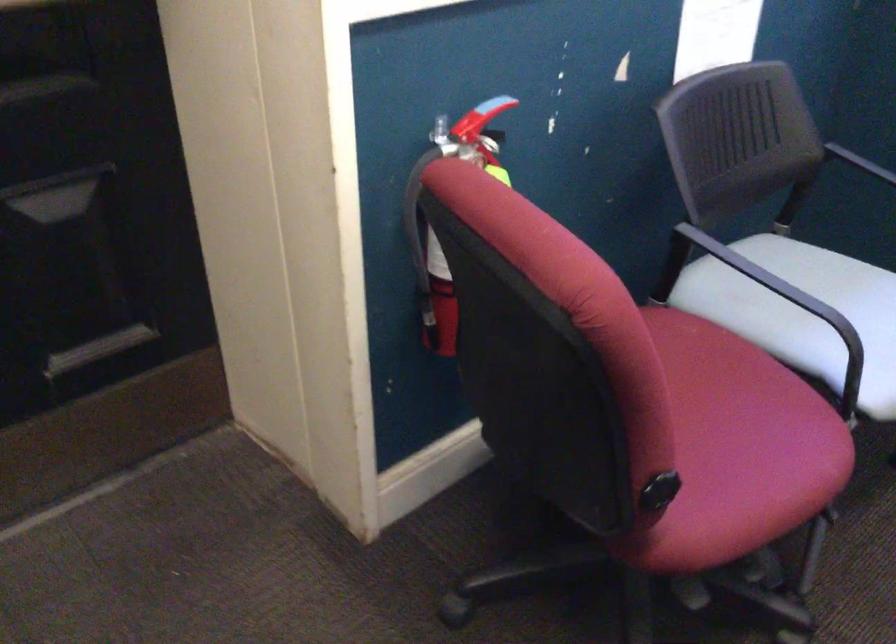
This screenshot has height=644, width=896. I want to click on chair adjustment knob, so click(x=658, y=494).